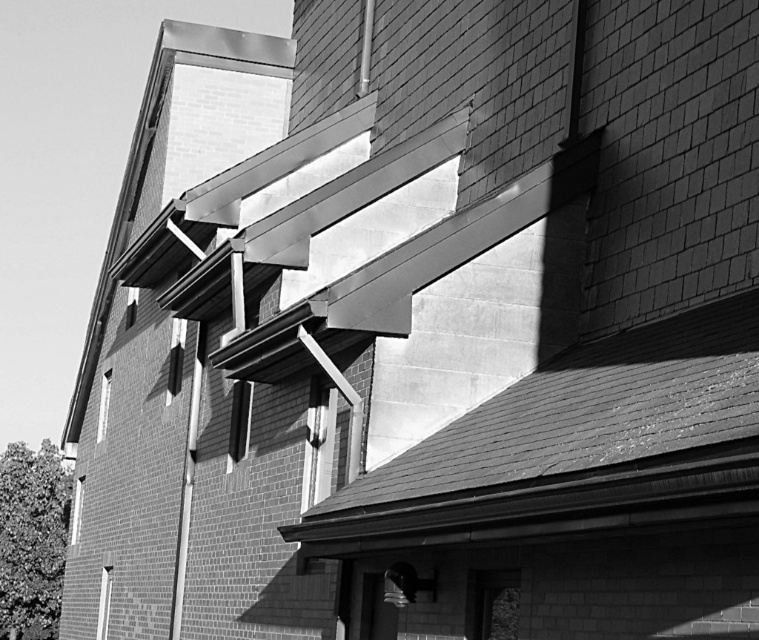
Which is below, transparent glass window at lower center or clear glass window at center?

transparent glass window at lower center is below.

Who is more distant from viewer, (518,600) or (238,396)?

The point (238,396) is behind.

Between point (480, 582) and point (238, 396), which one is positioned behind?

Point (238, 396)

The image size is (759, 640). What are the coordinates of `transparent glass window at lower center` in the screenshot? It's located at coord(493,604).

Is transparent glass window at lower center closer to the viewer compared to transparent glass window at lower left?

That is True.

Does point (493, 572) come behind point (106, 637)?

No, (493, 572) is in front of (106, 637).

Which is behind, point (496, 634) or point (106, 605)?

Positioned behind is point (106, 605).

Identify the location of transparent glass window at lower center. (493, 604).

Based on the photo, is clear glass window at center smaller than clear glass window at upper left?

Correct, clear glass window at center occupies less space than clear glass window at upper left.

Which is behind, point (235, 417) or point (102, 419)?

Point (102, 419)

Identify the location of clear glass window at center. (238, 420).